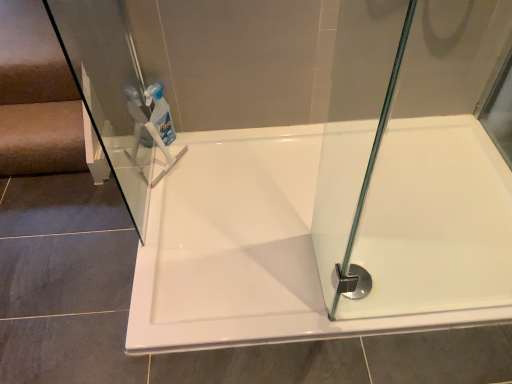
Question: Considering the relative sizes of white glossy bathtub at center and transparent plastic bottle at upper center in the image provided, is white glossy bathtub at center thinner than transparent plastic bottle at upper center?

Choices:
 (A) no
 (B) yes

Answer: (A)

Question: Is white glossy bathtub at center turned away from transparent plastic bottle at upper center?

Choices:
 (A) no
 (B) yes

Answer: (A)

Question: Could you tell me if white glossy bathtub at center is facing transparent plastic bottle at upper center?

Choices:
 (A) yes
 (B) no

Answer: (B)

Question: From the image's perspective, is white glossy bathtub at center below transparent plastic bottle at upper center?

Choices:
 (A) no
 (B) yes

Answer: (B)

Question: Does white glossy bathtub at center have a greater height compared to transparent plastic bottle at upper center?

Choices:
 (A) yes
 (B) no

Answer: (B)

Question: Based on their sizes in the image, would you say polished chrome shower at bottom right is bigger or smaller than transparent plastic bottle at upper center?

Choices:
 (A) big
 (B) small

Answer: (B)

Question: Considering their positions, is polished chrome shower at bottom right located in front of or behind transparent plastic bottle at upper center?

Choices:
 (A) behind
 (B) front

Answer: (B)

Question: Is point (362, 289) closer or farther from the camera than point (168, 135)?

Choices:
 (A) closer
 (B) farther

Answer: (A)

Question: From the image's perspective, is polished chrome shower at bottom right located above or below transparent plastic bottle at upper center?

Choices:
 (A) below
 (B) above

Answer: (A)

Question: Relative to transparent plastic bottle at upper center, is white glossy bathtub at center in front or behind?

Choices:
 (A) behind
 (B) front

Answer: (B)

Question: From their relative heights in the image, would you say white glossy bathtub at center is taller or shorter than transparent plastic bottle at upper center?

Choices:
 (A) tall
 (B) short

Answer: (B)

Question: Does point pyautogui.click(x=283, y=172) appear closer or farther from the camera than point pyautogui.click(x=161, y=112)?

Choices:
 (A) closer
 (B) farther

Answer: (A)

Question: From the image's perspective, is white glossy bathtub at center located above or below transparent plastic bottle at upper center?

Choices:
 (A) below
 (B) above

Answer: (A)

Question: Considering the relative positions of transparent plastic bottle at upper center and polished chrome shower at bottom right in the image provided, is transparent plastic bottle at upper center to the left or to the right of polished chrome shower at bottom right?

Choices:
 (A) right
 (B) left

Answer: (B)

Question: From their relative heights in the image, would you say transparent plastic bottle at upper center is taller or shorter than polished chrome shower at bottom right?

Choices:
 (A) tall
 (B) short

Answer: (A)